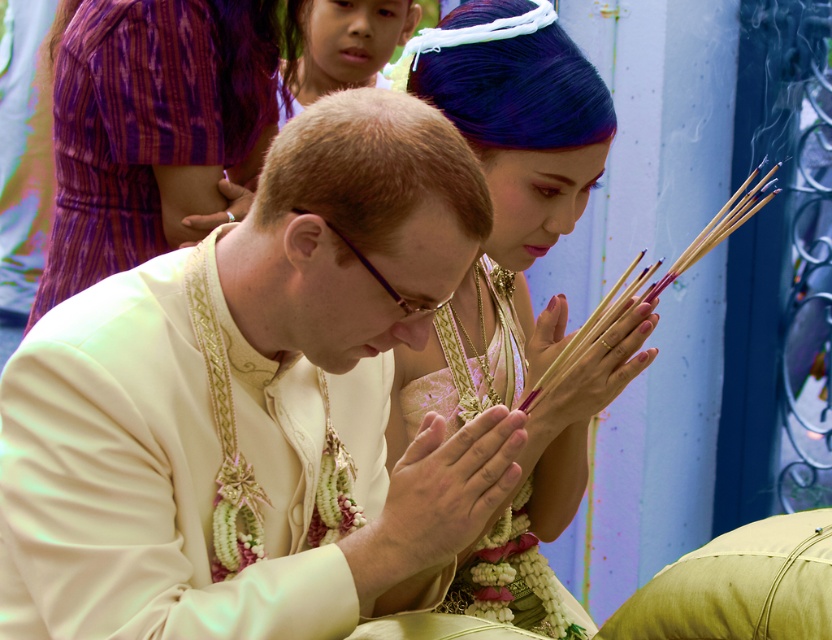
In the scene shown: You are a photographer standing at the point marked as point (17,552). You want to capture a photo of both individuals performing the ritual. Considering your position, will you be able to fit both individuals in the frame without moving?

The two individuals are 1.97 meters apart. Since you are positioned at point (17,552), you can capture both individuals in the frame as they are within a reasonable distance from each other and your vantage point allows for a wide enough angle to include both subjects.

You are an observer at the ceremony. You notice the matte gold necklace at center and the smooth skin hands at center. Which object is closer to the viewer?

The matte gold necklace at center is positioned over the smooth skin hands at center, so it is closer to the viewer.